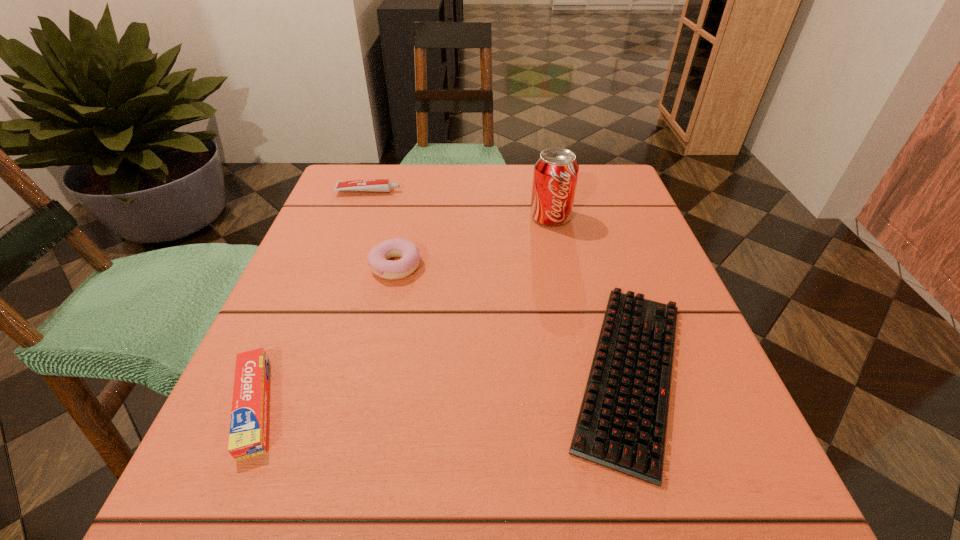
Identify the location of vacant space that satisfies the following two spatial constraints: 1. on the back side of the second farthest object; 2. at the nozzle of the farthest object. The width and height of the screenshot is (960, 540). (545, 191).

Locate an element on the screen. The height and width of the screenshot is (540, 960). vacant space that satisfies the following two spatial constraints: 1. at the nozzle of the farther toothpaste; 2. on the left side of the shortest object is located at coordinates (304, 372).

In order to click on vacant space that satisfies the following two spatial constraints: 1. at the nozzle of the farthest object; 2. on the back side of the soda can in this screenshot , I will do `click(359, 217)`.